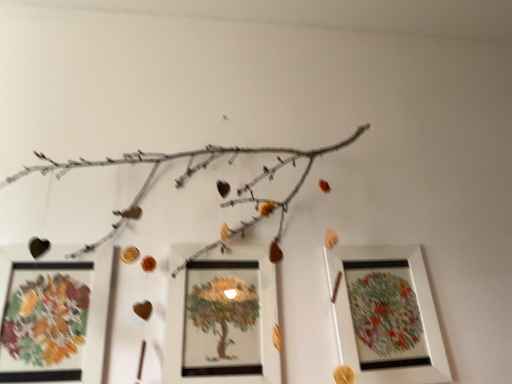
Question: Considering their positions, is matte glass picture frame at lower left, the third picture frame from the right, located in front of or behind white matte picture frame at right, marked as the third picture frame in a left-to-right arrangement?

Choices:
 (A) front
 (B) behind

Answer: (A)

Question: From a real-world perspective, is matte glass picture frame at lower left, which ranks as the first picture frame in left-to-right order, physically located above or below white matte picture frame at right, the first picture frame when ordered from right to left?

Choices:
 (A) above
 (B) below

Answer: (B)

Question: Which object is the closest to the matte glass picture frame at lower left, which ranks as the first picture frame in left-to-right order?

Choices:
 (A) white matte picture frame at right, the first picture frame when ordered from right to left
 (B) matte white picture frame at center, positioned as the 2th picture frame in left-to-right order

Answer: (B)

Question: Considering the real-world distances, which object is closest to the white matte picture frame at right, marked as the third picture frame in a left-to-right arrangement?

Choices:
 (A) matte glass picture frame at lower left, which ranks as the first picture frame in left-to-right order
 (B) matte white picture frame at center, positioned as the 2th picture frame in right-to-left order

Answer: (B)